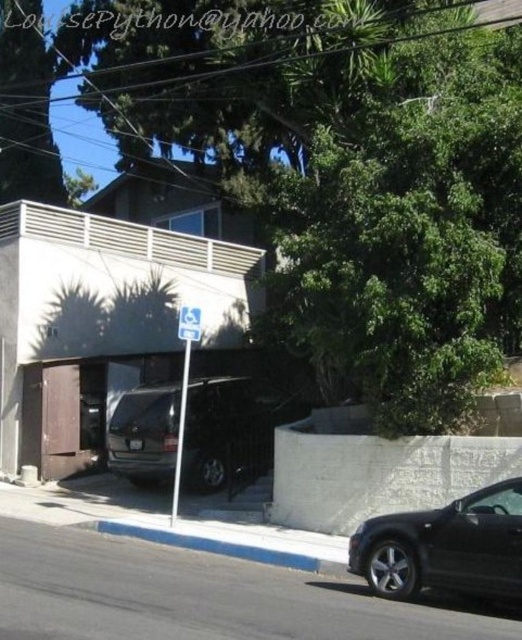
Question: Is black matte car at lower right wider than blue painted concrete curb at lower center?

Choices:
 (A) yes
 (B) no

Answer: (B)

Question: Is black matte car at lower right positioned behind blue plastic sign at center?

Choices:
 (A) yes
 (B) no

Answer: (B)

Question: Among these points, which one is nearest to the camera?

Choices:
 (A) (196, 540)
 (B) (507, 481)
 (C) (151, 403)
 (D) (171, 515)

Answer: (B)

Question: Which point appears farthest from the camera in this image?

Choices:
 (A) (185, 336)
 (B) (282, 563)

Answer: (A)

Question: Which of the following is the closest to the observer?

Choices:
 (A) blue plastic sign at center
 (B) matte gray suv at center
 (C) black matte car at lower right

Answer: (C)

Question: From the image, what is the correct spatial relationship of matte gray suv at center in relation to blue painted concrete curb at lower center?

Choices:
 (A) above
 (B) below

Answer: (A)